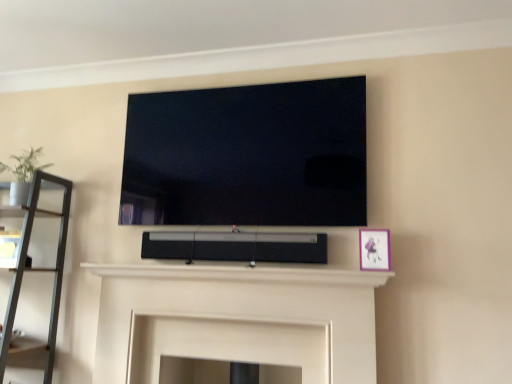
Question: From the image's perspective, would you say matte pink picture frame at right is positioned over flat screen tv at upper center?

Choices:
 (A) no
 (B) yes

Answer: (A)

Question: Is matte pink picture frame at right oriented away from flat screen tv at upper center?

Choices:
 (A) yes
 (B) no

Answer: (B)

Question: Considering the relative sizes of matte pink picture frame at right and flat screen tv at upper center in the image provided, is matte pink picture frame at right wider than flat screen tv at upper center?

Choices:
 (A) yes
 (B) no

Answer: (A)

Question: Would you say matte pink picture frame at right is a long distance from flat screen tv at upper center?

Choices:
 (A) yes
 (B) no

Answer: (B)

Question: Does matte pink picture frame at right have a lesser height compared to flat screen tv at upper center?

Choices:
 (A) yes
 (B) no

Answer: (A)

Question: Which is correct: matte pink picture frame at right is inside white matte fireplace at center, or outside of it?

Choices:
 (A) inside
 (B) outside

Answer: (B)

Question: From the image's perspective, is matte pink picture frame at right located above or below white matte fireplace at center?

Choices:
 (A) below
 (B) above

Answer: (B)

Question: From a real-world perspective, relative to white matte fireplace at center, is matte pink picture frame at right vertically above or below?

Choices:
 (A) below
 (B) above

Answer: (B)

Question: Considering the positions of matte pink picture frame at right and white matte fireplace at center in the image, is matte pink picture frame at right bigger or smaller than white matte fireplace at center?

Choices:
 (A) big
 (B) small

Answer: (B)

Question: Is flat screen tv at upper center to the left or to the right of matte black shelf at left in the image?

Choices:
 (A) right
 (B) left

Answer: (A)

Question: Is flat screen tv at upper center inside or outside of matte black shelf at left?

Choices:
 (A) outside
 (B) inside

Answer: (A)

Question: Considering the positions of flat screen tv at upper center and matte black shelf at left in the image, is flat screen tv at upper center wider or thinner than matte black shelf at left?

Choices:
 (A) wide
 (B) thin

Answer: (B)

Question: From the image's perspective, is flat screen tv at upper center located above or below matte black shelf at left?

Choices:
 (A) above
 (B) below

Answer: (A)

Question: Considering their positions, is black matte speaker at center located in front of or behind green matte plant at left?

Choices:
 (A) front
 (B) behind

Answer: (A)

Question: Which is correct: black matte speaker at center is inside green matte plant at left, or outside of it?

Choices:
 (A) inside
 (B) outside

Answer: (B)